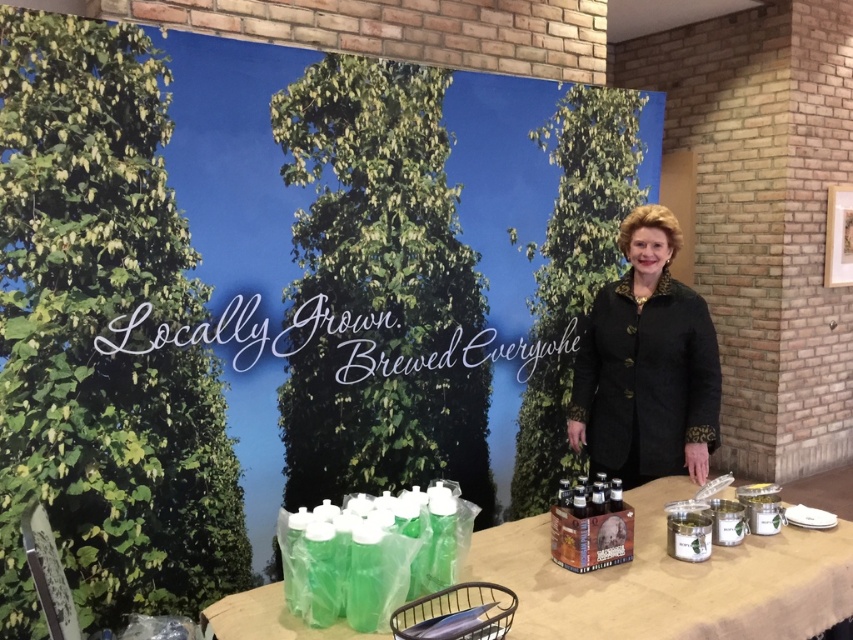
Is translucent plastic bottles at lower left wider than black textured coat at center?

Yes.

At what (x,y) coordinates should I click in order to perform the action: click on translucent plastic bottles at lower left. Please return your answer as a coordinate pair (x, y). Looking at the image, I should click on (671, 580).

Locate an element on the screen. The height and width of the screenshot is (640, 853). translucent plastic bottles at lower left is located at coordinates (671, 580).

Measure the distance between point (x=799, y=557) and camera.

They are 6.36 feet apart.

Locate an element on the screen. Image resolution: width=853 pixels, height=640 pixels. translucent plastic bottles at lower left is located at coordinates (671, 580).

Does black textured coat at center have a greater height compared to green plastic bottles at lower left?

Indeed, black textured coat at center has a greater height compared to green plastic bottles at lower left.

Between black textured coat at center and green plastic bottles at lower left, which one is positioned higher?

black textured coat at center is above.

Where is `black textured coat at center`? Image resolution: width=853 pixels, height=640 pixels. black textured coat at center is located at coordinates (646, 364).